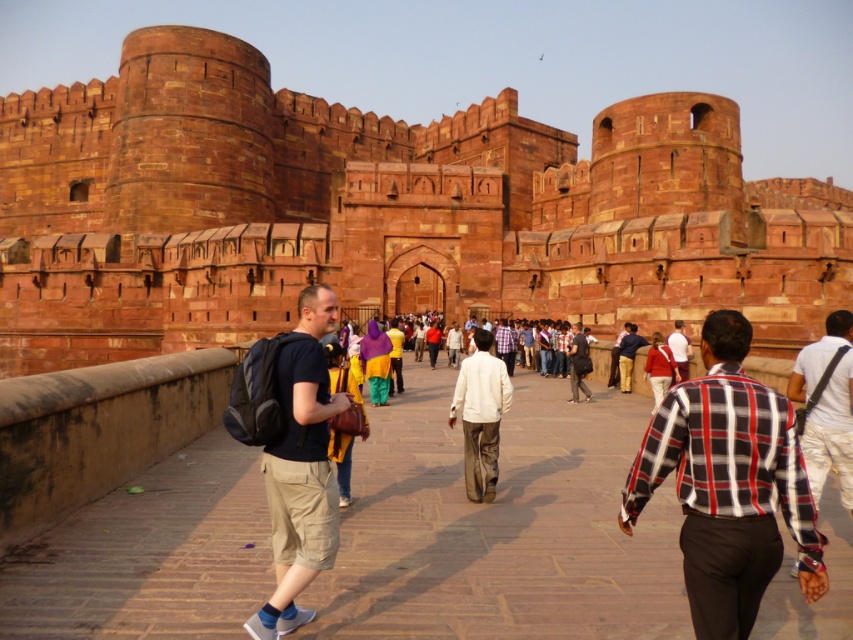
Question: Among these objects, which one is farthest from the camera?

Choices:
 (A) white shirt at center
 (B) red plaid shirt at center
 (C) reddish-brown stone castle at center
 (D) dark gray shirt at center

Answer: (C)

Question: Considering the relative positions of brown brick pathway at center and white cotton shirt at center in the image provided, where is brown brick pathway at center located with respect to white cotton shirt at center?

Choices:
 (A) right
 (B) left

Answer: (B)

Question: Does brown brick pathway at center appear on the right side of white cotton shirt at center?

Choices:
 (A) yes
 (B) no

Answer: (B)

Question: Which of the following is the farthest from the observer?

Choices:
 (A) (575, 323)
 (B) (851, 401)

Answer: (A)

Question: Is red plaid shirt at center above matte brown pants at center?

Choices:
 (A) yes
 (B) no

Answer: (A)

Question: Which point appears closest to the camera in this image?

Choices:
 (A) (485, 337)
 (B) (837, 410)
 (C) (296, 548)
 (D) (630, 339)

Answer: (C)